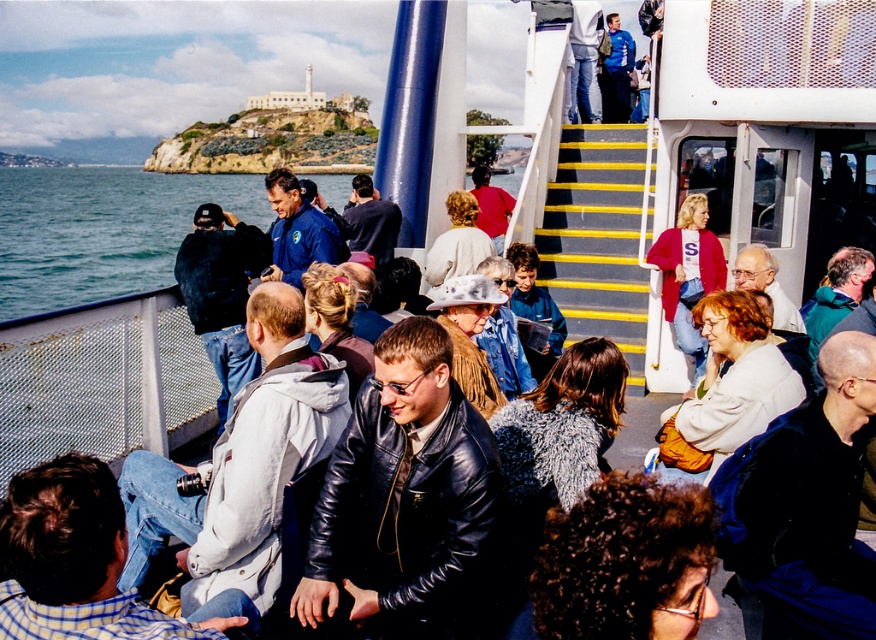
Question: Can you confirm if white fuzzy jacket at center is positioned to the right of dark blue jacket at left?

Choices:
 (A) yes
 (B) no

Answer: (A)

Question: Is shiny black leather jacket at center positioned at the back of white woolen hat at center?

Choices:
 (A) no
 (B) yes

Answer: (A)

Question: Which object is closer to the camera taking this photo?

Choices:
 (A) leather jacket at center
 (B) dark blue leather jacket at lower right
 (C) green fabric jacket at center

Answer: (B)

Question: Which object appears farthest from the camera in this image?

Choices:
 (A) dark blue leather jacket at lower right
 (B) red sweater at upper right

Answer: (B)

Question: Is dark blue leather jacket at lower right to the right of leather jacket at center from the viewer's perspective?

Choices:
 (A) no
 (B) yes

Answer: (B)

Question: Which object is closer to the camera taking this photo?

Choices:
 (A) dark blue leather jacket at lower right
 (B) light brown hair at center
 (C) dark curly hair at center

Answer: (C)